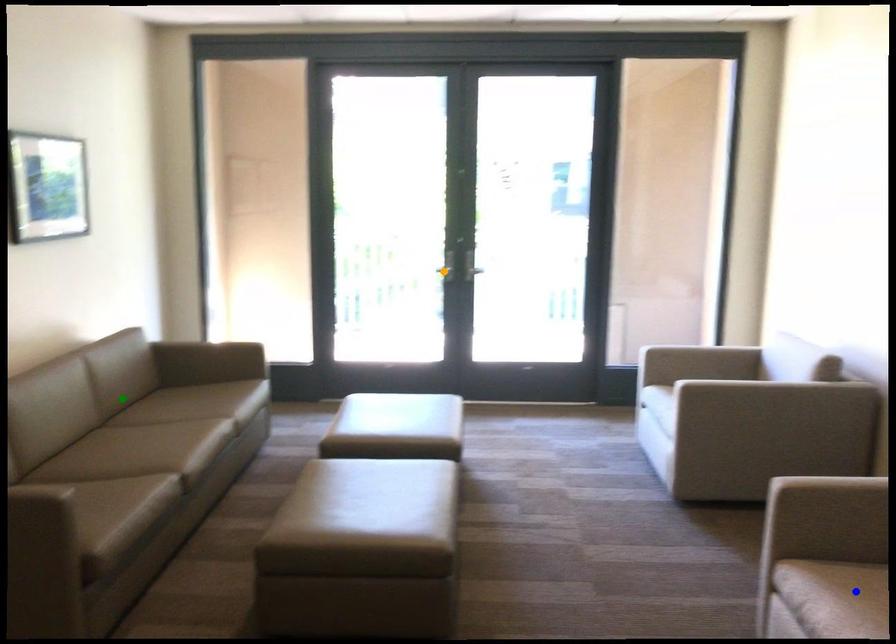
Order these from nearest to farthest:
1. green point
2. orange point
3. blue point

blue point < green point < orange point